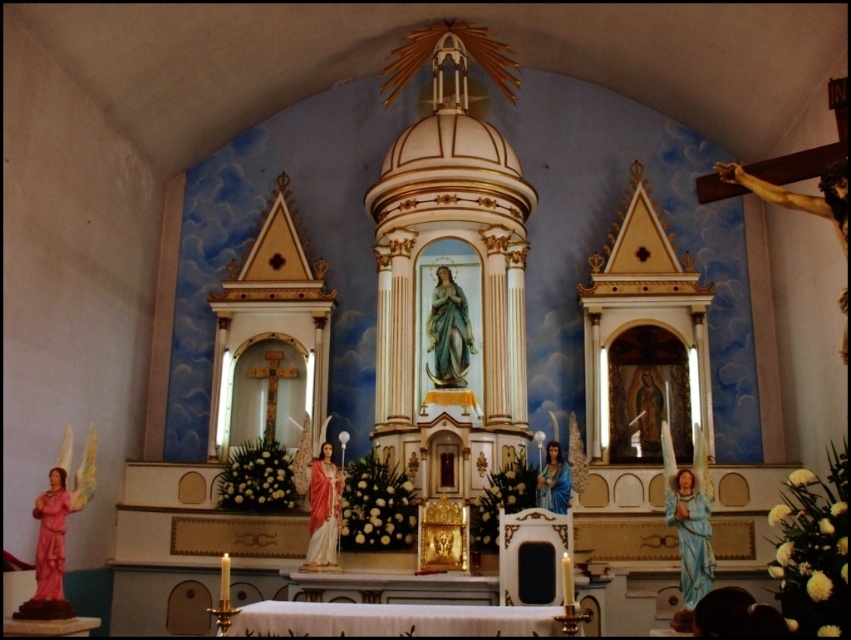
Locate an element on the screen. This screenshot has width=851, height=640. smooth green statue at center is located at coordinates (448, 332).

Who is positioned more to the right, smooth green statue at center or wooden statue of jesus at center?

From the viewer's perspective, wooden statue of jesus at center appears more on the right side.

Between point (464, 301) and point (647, 394), which one is positioned in front?

Point (464, 301)

This screenshot has width=851, height=640. What are the coordinates of `smooth green statue at center` in the screenshot? It's located at (448, 332).

From the picture: Does matte gold statue at center have a lesser width compared to blue glossy statue at center?

In fact, matte gold statue at center might be wider than blue glossy statue at center.

Is matte gold statue at center behind blue glossy statue at center?

That is False.

Is point (328, 556) less distant than point (544, 500)?

Yes.

The width and height of the screenshot is (851, 640). What are the coordinates of `matte gold statue at center` in the screenshot? It's located at (323, 509).

Who is shorter, pink glossy statue at lower left or wooden statue of jesus at center?

Standing shorter between the two is wooden statue of jesus at center.

Can you confirm if pink glossy statue at lower left is positioned to the left of wooden statue of jesus at center?

Correct, you'll find pink glossy statue at lower left to the left of wooden statue of jesus at center.

Does point (83, 499) lie behind point (650, 392)?

No, (83, 499) is in front of (650, 392).

Locate an element on the screen. The height and width of the screenshot is (640, 851). pink glossy statue at lower left is located at coordinates [x=53, y=532].